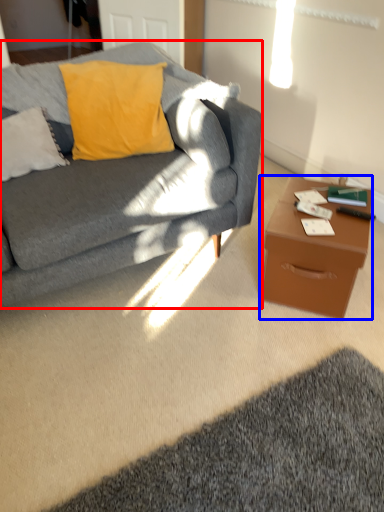
Question: Which object appears farthest to the camera in this image, studio couch (highlighted by a red box) or desk (highlighted by a blue box)?

Choices:
 (A) studio couch
 (B) desk

Answer: (B)